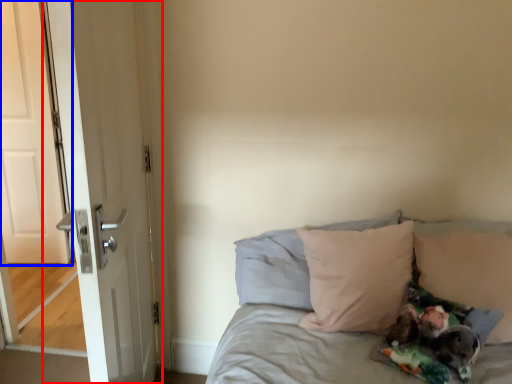
Question: Which object appears closest to the camera in this image, door (highlighted by a red box) or door (highlighted by a blue box)?

Choices:
 (A) door
 (B) door

Answer: (A)